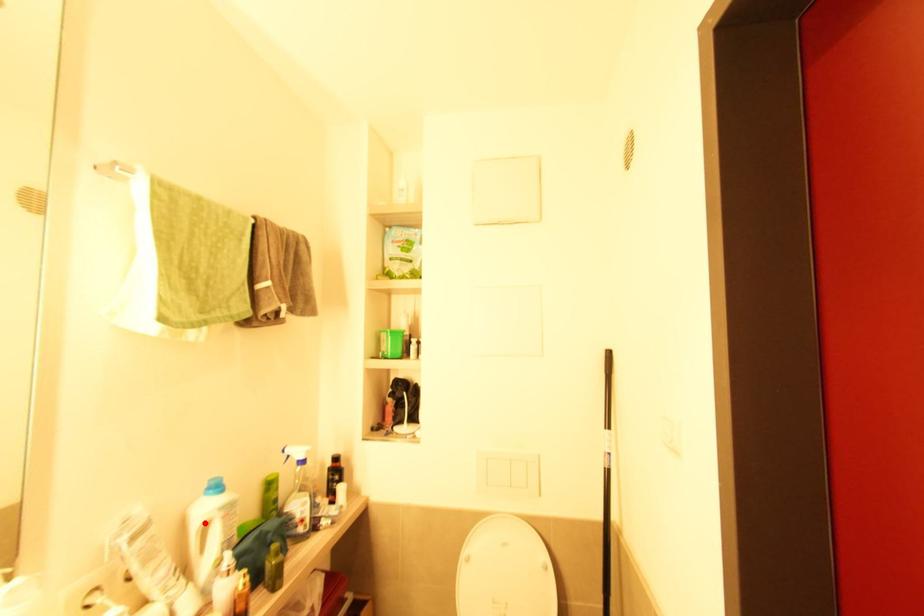
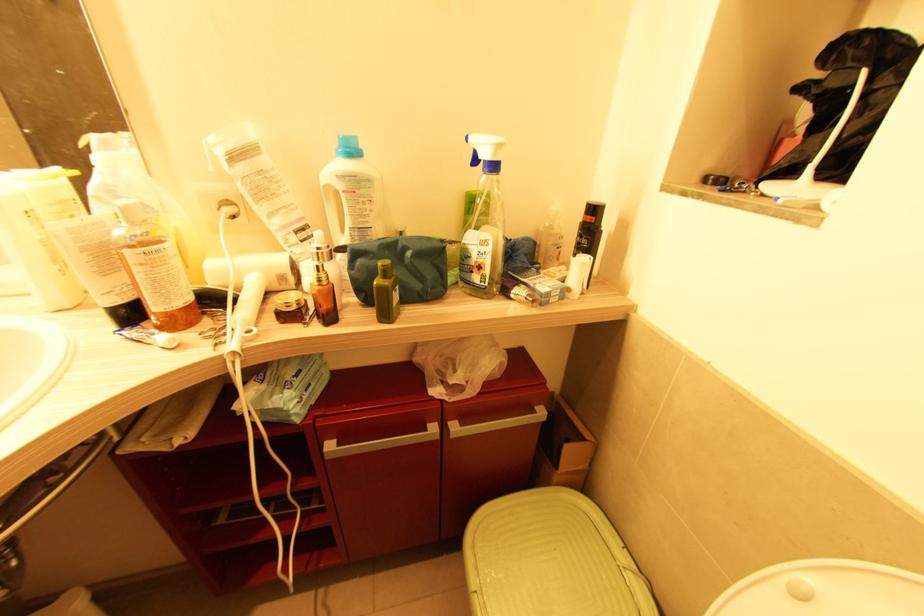
Find the pixel in the second image that matches the highlighted location in the first image.

(329, 188)